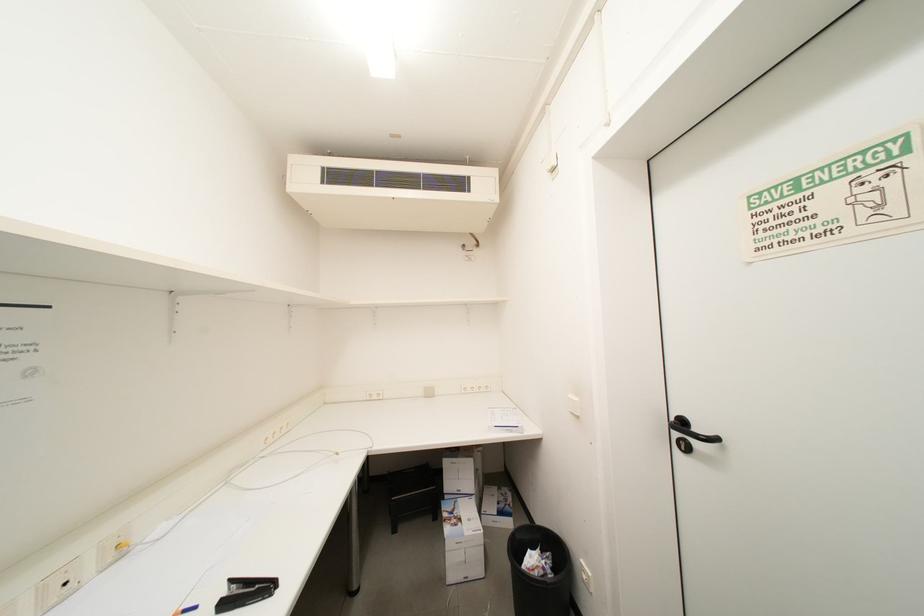
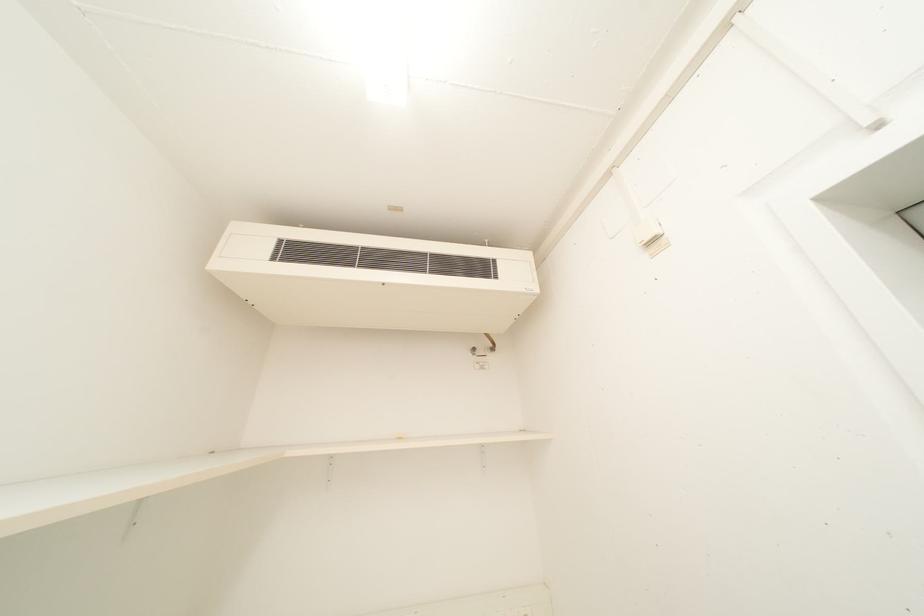
Question: How did the camera likely rotate?

Choices:
 (A) Left
 (B) Right
 (C) Up
 (D) Down

Answer: (C)